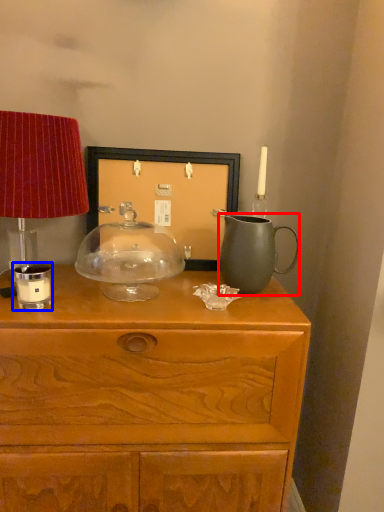
Question: Which of the following is the closest to the observer, jug (highlighted by a red box) or candle holder (highlighted by a blue box)?

Choices:
 (A) jug
 (B) candle holder

Answer: (B)